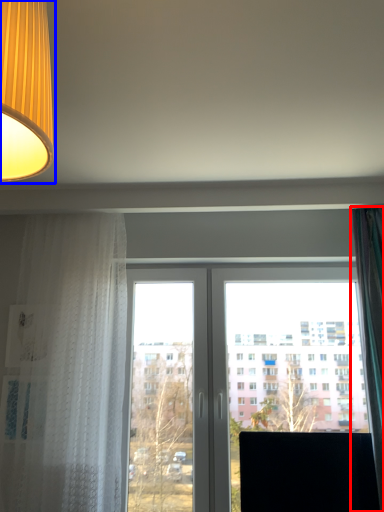
Question: Which point is closer to the camera, curtain (highlighted by a red box) or lamp (highlighted by a blue box)?

Choices:
 (A) curtain
 (B) lamp

Answer: (B)